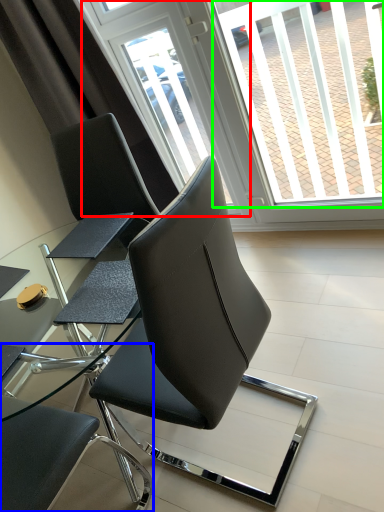
Question: Which is nearer to the screen door (highlighted by a red box)? chair (highlighted by a blue box) or window screen (highlighted by a green box).

Choices:
 (A) chair
 (B) window screen

Answer: (B)